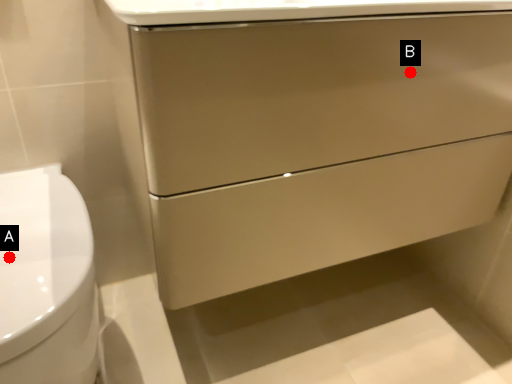
Question: Two points are circled on the image, labeled by A and B beside each circle. Which point is farther from the camera taking this photo?

Choices:
 (A) A is further
 (B) B is further

Answer: (B)